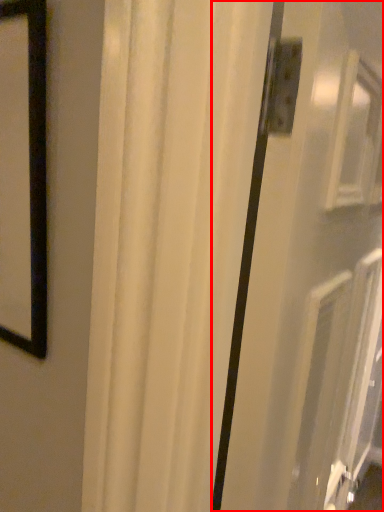
Question: Where is screen door (annotated by the red box) located in relation to curtain in the image?

Choices:
 (A) left
 (B) right

Answer: (A)